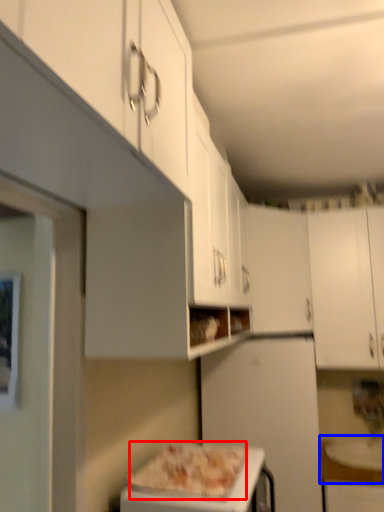
Question: Which object is closer to the camera taking this photo, pizza (highlighted by a red box) or counter top (highlighted by a blue box)?

Choices:
 (A) pizza
 (B) counter top

Answer: (A)